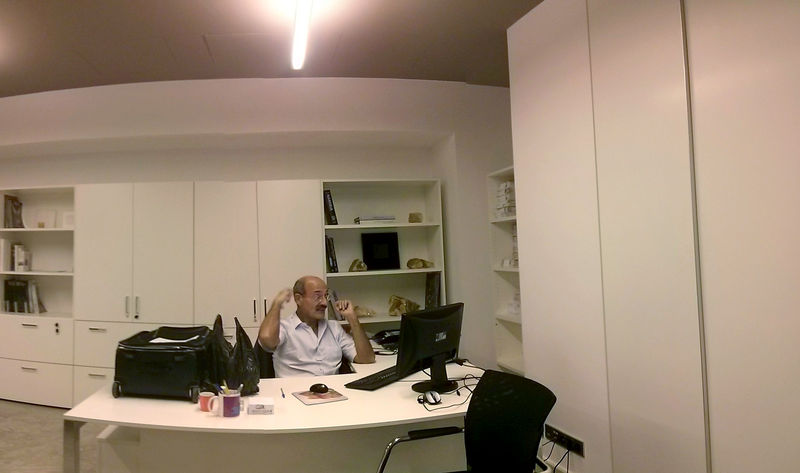
Image resolution: width=800 pixels, height=473 pixels. In order to click on coffee mug in this screenshot , I will do `click(233, 407)`.